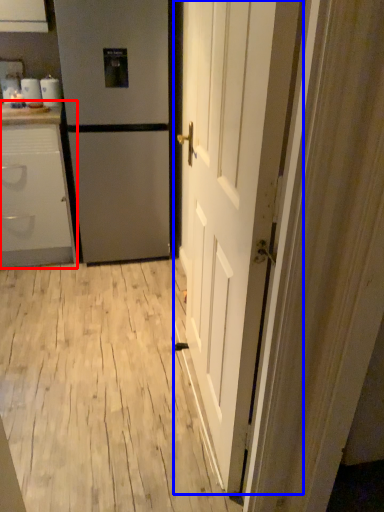
Question: Which of the following is the closest to the observer, cabinetry (highlighted by a red box) or door (highlighted by a blue box)?

Choices:
 (A) cabinetry
 (B) door

Answer: (B)